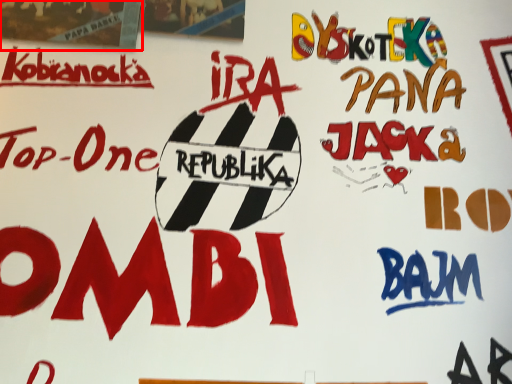
Question: From the image's perspective, considering the relative positions of poster (annotated by the red box) and poster in the image provided, where is poster (annotated by the red box) located with respect to the staircase?

Choices:
 (A) above
 (B) below

Answer: (B)